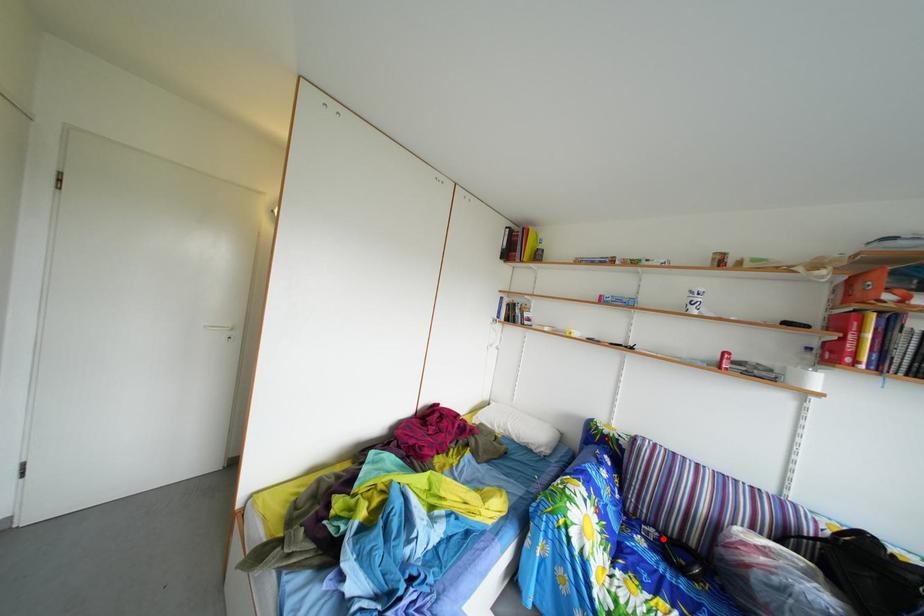
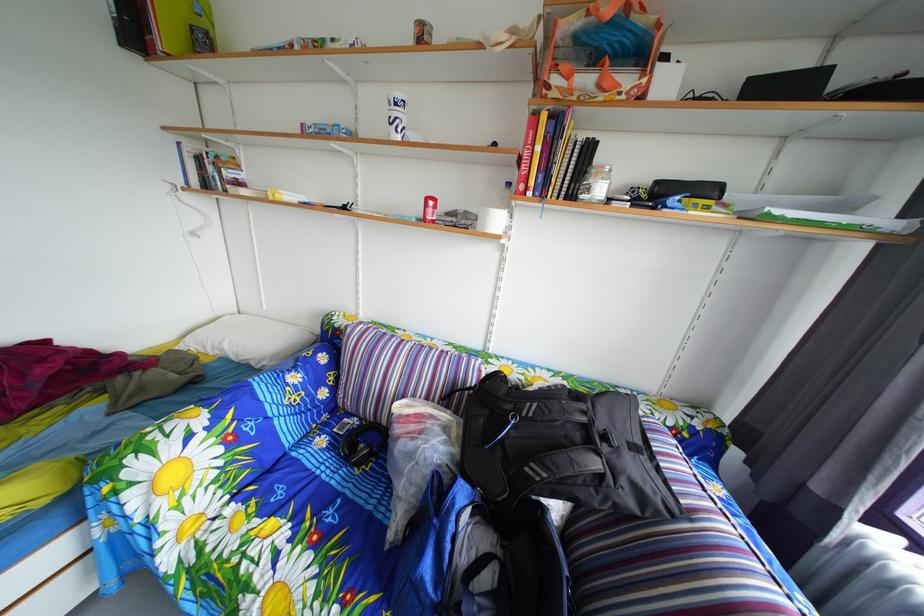
Where in the second image is the point corresponding to the highlighted location from the first image?

(367, 428)